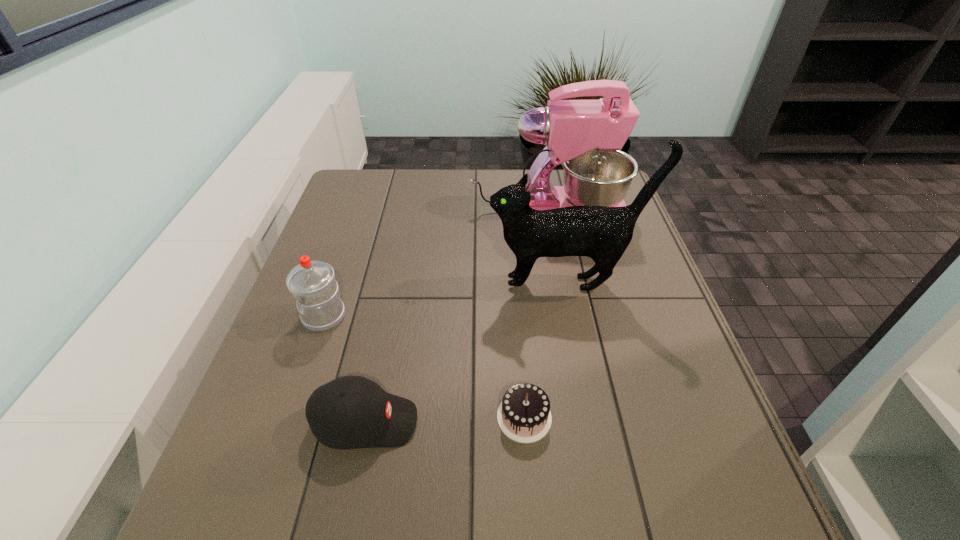
Image resolution: width=960 pixels, height=540 pixels. I want to click on cat, so click(x=602, y=233).

Locate an element on the screen. This screenshot has height=540, width=960. mixer is located at coordinates (585, 136).

Find the location of `water bottle`. water bottle is located at coordinates (312, 283).

What are the coordinates of `the third nearest object` in the screenshot? It's located at (312, 283).

Where is `baseball cap`? The image size is (960, 540). baseball cap is located at coordinates (350, 412).

Find the location of a particular element. the shortest object is located at coordinates (524, 415).

This screenshot has width=960, height=540. What are the coordinates of `vacant space situated on the face of the fourth nearest object` in the screenshot? It's located at (402, 284).

At what (x,y) coordinates should I click in order to perform the action: click on vacant space positioned on the face of the fourth nearest object. Please return your answer as a coordinate pair (x, y). The width and height of the screenshot is (960, 540). Looking at the image, I should click on (425, 284).

Where is `free region located on the face of the fourth nearest object`? free region located on the face of the fourth nearest object is located at coordinates (414, 284).

The width and height of the screenshot is (960, 540). I want to click on free region located with a logo on the front of the baseball cap, so click(595, 422).